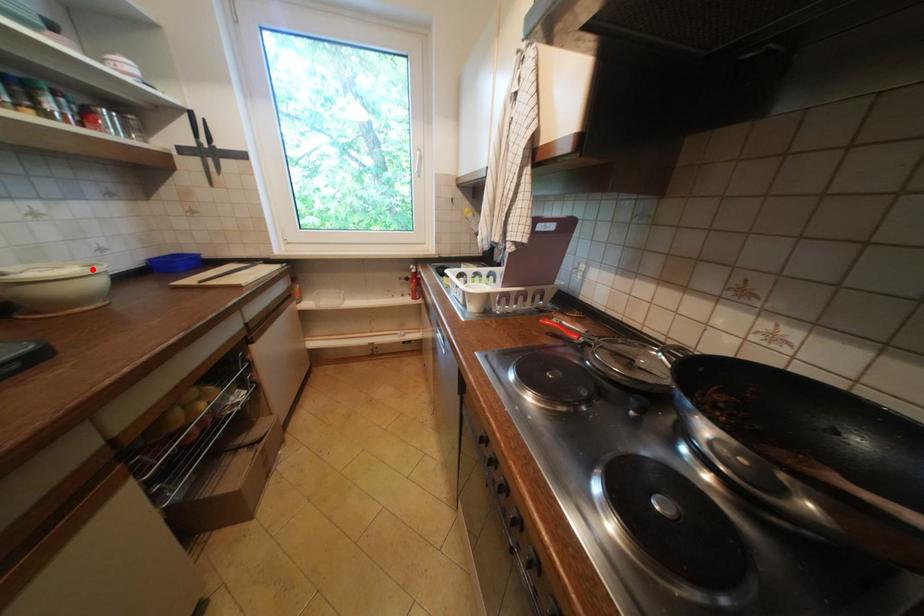
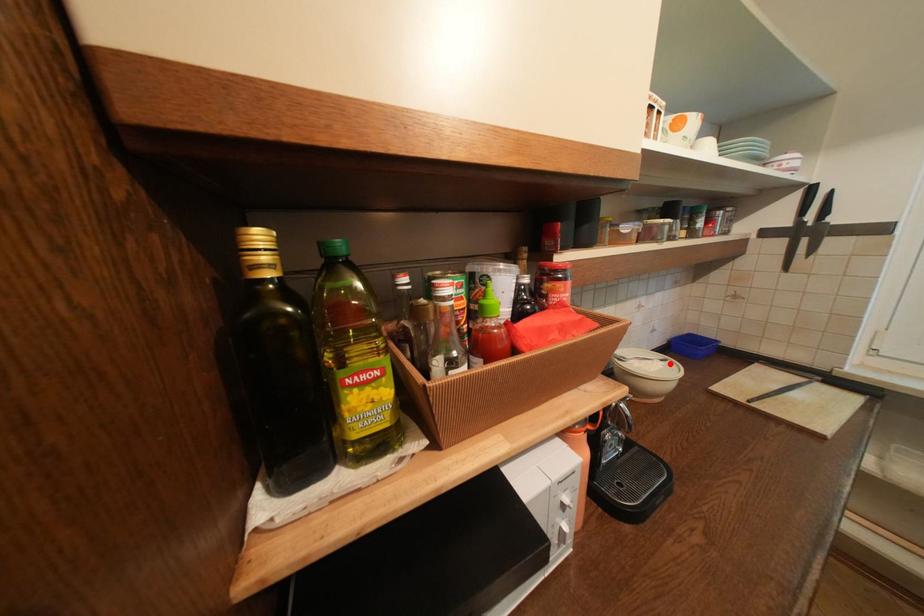
I am providing you with two images of the same scene from different viewpoints. A red point is marked on the first image and another point is marked on the second image. Are the points marked in image1 and image2 representing the same 3D position?

Yes